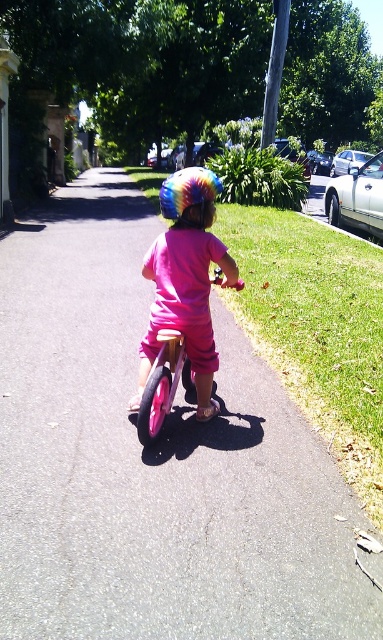
Find the location of a particular element. The image size is (383, 640). smooth asphalt at center is located at coordinates (153, 461).

Is smooth asphalt at center to the left of rainbow helmet at center from the viewer's perspective?

Yes, smooth asphalt at center is to the left of rainbow helmet at center.

Is point (16, 468) in front of point (229, 253)?

Yes, point (16, 468) is closer to viewer.

Where is `smooth asphalt at center`? The width and height of the screenshot is (383, 640). smooth asphalt at center is located at coordinates (153, 461).

Where is `smooth asphalt at center`? This screenshot has height=640, width=383. smooth asphalt at center is located at coordinates (153, 461).

Is smooth asphalt at center above rainbow tie-dye helmet at center?

Incorrect, smooth asphalt at center is not positioned above rainbow tie-dye helmet at center.

Measure the distance between point (145,243) and camera.

Point (145,243) and camera are 9.46 meters apart from each other.

The width and height of the screenshot is (383, 640). Identify the location of smooth asphalt at center. coord(153,461).

Does rainbow helmet at center have a smaller size compared to rainbow tie-dye helmet at center?

Indeed, rainbow helmet at center has a smaller size compared to rainbow tie-dye helmet at center.

Measure the distance between rainbow helmet at center and rainbow tie-dye helmet at center.

They are 1.23 meters apart.

What do you see at coordinates (186, 280) in the screenshot? I see `rainbow helmet at center` at bounding box center [186, 280].

This screenshot has height=640, width=383. What are the coordinates of `rainbow helmet at center` in the screenshot? It's located at (186, 280).